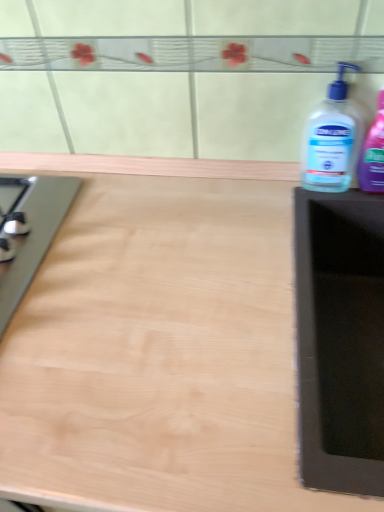
Find the location of `transparent plastic bottle at right, which is the 1th bottle from right to left`. transparent plastic bottle at right, which is the 1th bottle from right to left is located at coordinates (373, 153).

Where is `light wood countertop at center`? light wood countertop at center is located at coordinates (159, 344).

Considering the relative sizes of transparent plastic bottle at right, which appears as the 2th bottle when viewed from the right, and light wood countertop at center in the image provided, is transparent plastic bottle at right, which appears as the 2th bottle when viewed from the right, taller than light wood countertop at center?

Incorrect, the height of transparent plastic bottle at right, which appears as the 2th bottle when viewed from the right, is not larger of that of light wood countertop at center.

In the scene shown: Visually, is transparent plastic bottle at right, which appears as the 2th bottle when viewed from the right, positioned to the left or to the right of light wood countertop at center?

From the image, it's evident that transparent plastic bottle at right, which appears as the 2th bottle when viewed from the right, is to the right of light wood countertop at center.

This screenshot has width=384, height=512. I want to click on countertop in front of the transparent plastic bottle at right, the first bottle when ordered from left to right, so click(159, 344).

Considering the points (231, 418) and (358, 112), which point is behind, point (231, 418) or point (358, 112)?

The point (358, 112) is behind.

Which of these two, light wood countertop at center or transparent plastic bottle at right, the first bottle when ordered from left to right, is smaller?

Smaller between the two is transparent plastic bottle at right, the first bottle when ordered from left to right.

From the image's perspective, which is below, light wood countertop at center or transparent plastic bottle at right, the first bottle when ordered from left to right?

From the image's view, light wood countertop at center is below.

Can you confirm if light wood countertop at center is shorter than transparent plastic bottle at right, the first bottle when ordered from left to right?

Incorrect, the height of light wood countertop at center does not fall short of that of transparent plastic bottle at right, the first bottle when ordered from left to right.

Is transparent plastic bottle at right, arranged as the 2th bottle when viewed from the left, next to light wood countertop at center and touching it?

There is a gap between transparent plastic bottle at right, arranged as the 2th bottle when viewed from the left, and light wood countertop at center.

From the image's perspective, which object appears higher, transparent plastic bottle at right, which is the 1th bottle from right to left, or light wood countertop at center?

transparent plastic bottle at right, which is the 1th bottle from right to left, from the image's perspective.

This screenshot has height=512, width=384. What are the coordinates of `the 2nd bottle to the right of the light wood countertop at center, starting your count from the anchor` in the screenshot? It's located at (373, 153).

Does point (364, 180) lie in front of point (248, 229)?

That is False.

Which point is more forward, (346, 118) or (376, 138)?

The point (376, 138) is closer to the camera.

From the image's perspective, is transparent plastic bottle at right, the first bottle when ordered from left to right, located beneath transparent plastic bottle at right, arranged as the 2th bottle when viewed from the left?

Indeed, from the image's perspective, transparent plastic bottle at right, the first bottle when ordered from left to right, is shown beneath transparent plastic bottle at right, arranged as the 2th bottle when viewed from the left.

Is transparent plastic bottle at right, arranged as the 2th bottle when viewed from the left, inside transparent plastic bottle at right, the first bottle when ordered from left to right?

No, transparent plastic bottle at right, arranged as the 2th bottle when viewed from the left, is not inside transparent plastic bottle at right, the first bottle when ordered from left to right.

Considering the relative sizes of transparent plastic bottle at right, the first bottle when ordered from left to right, and transparent plastic bottle at right, arranged as the 2th bottle when viewed from the left, in the image provided, is transparent plastic bottle at right, the first bottle when ordered from left to right, bigger than transparent plastic bottle at right, arranged as the 2th bottle when viewed from the left,?

Correct, transparent plastic bottle at right, the first bottle when ordered from left to right, is larger in size than transparent plastic bottle at right, arranged as the 2th bottle when viewed from the left.

Consider the image. Is light wood countertop at center touching transparent plastic bottle at right, which is the 1th bottle from right to left?

No, light wood countertop at center is not with transparent plastic bottle at right, which is the 1th bottle from right to left.

Is point (142, 424) less distant than point (360, 176)?

Yes, it is in front of point (360, 176).

Is light wood countertop at center at the left side of transparent plastic bottle at right, arranged as the 2th bottle when viewed from the left?

Yes, light wood countertop at center is to the left of transparent plastic bottle at right, arranged as the 2th bottle when viewed from the left.

Can you confirm if transparent plastic bottle at right, which is the 1th bottle from right to left, is positioned to the right of transparent plastic bottle at right, which appears as the 2th bottle when viewed from the right?

Yes.

Is the surface of transparent plastic bottle at right, arranged as the 2th bottle when viewed from the left, in direct contact with transparent plastic bottle at right, which appears as the 2th bottle when viewed from the right?

Yes, transparent plastic bottle at right, arranged as the 2th bottle when viewed from the left, is in contact with transparent plastic bottle at right, which appears as the 2th bottle when viewed from the right.

From a real-world perspective, is transparent plastic bottle at right, arranged as the 2th bottle when viewed from the left, located beneath transparent plastic bottle at right, which appears as the 2th bottle when viewed from the right?

No, from a real-world perspective, transparent plastic bottle at right, arranged as the 2th bottle when viewed from the left, is not under transparent plastic bottle at right, which appears as the 2th bottle when viewed from the right.

Consider the image. Is transparent plastic bottle at right, arranged as the 2th bottle when viewed from the left, thinner than transparent plastic bottle at right, the first bottle when ordered from left to right?

Yes.

Find the location of a particular element. Image resolution: width=384 pixels, height=512 pixels. bottle that is the 1st one when counting upward from the light wood countertop at center (from the image's perspective) is located at coordinates (332, 140).

Where is `countertop below the transparent plastic bottle at right, which appears as the 2th bottle when viewed from the right (from the image's perspective)`? countertop below the transparent plastic bottle at right, which appears as the 2th bottle when viewed from the right (from the image's perspective) is located at coordinates tap(159, 344).

Based on their spatial positions, is transparent plastic bottle at right, arranged as the 2th bottle when viewed from the left, or transparent plastic bottle at right, the first bottle when ordered from left to right, further from light wood countertop at center?

transparent plastic bottle at right, arranged as the 2th bottle when viewed from the left.

Based on their spatial positions, is transparent plastic bottle at right, arranged as the 2th bottle when viewed from the left, or light wood countertop at center further from transparent plastic bottle at right, which appears as the 2th bottle when viewed from the right?

light wood countertop at center is further to transparent plastic bottle at right, which appears as the 2th bottle when viewed from the right.

Based on their spatial positions, is transparent plastic bottle at right, which appears as the 2th bottle when viewed from the right, or light wood countertop at center further from transparent plastic bottle at right, which is the 1th bottle from right to left?

Based on the image, light wood countertop at center appears to be further to transparent plastic bottle at right, which is the 1th bottle from right to left.

Based on their spatial positions, is light wood countertop at center or transparent plastic bottle at right, the first bottle when ordered from left to right, closer to transparent plastic bottle at right, arranged as the 2th bottle when viewed from the left?

transparent plastic bottle at right, the first bottle when ordered from left to right.

Estimate the real-world distances between objects in this image. Which object is further from transparent plastic bottle at right, which appears as the 2th bottle when viewed from the right, light wood countertop at center or transparent plastic bottle at right, arranged as the 2th bottle when viewed from the left?

light wood countertop at center lies further to transparent plastic bottle at right, which appears as the 2th bottle when viewed from the right, than the other object.

Looking at the image, which one is located further to light wood countertop at center, transparent plastic bottle at right, which appears as the 2th bottle when viewed from the right, or transparent plastic bottle at right, which is the 1th bottle from right to left?

transparent plastic bottle at right, which is the 1th bottle from right to left, is positioned further to the anchor light wood countertop at center.

Locate an element on the screen. Image resolution: width=384 pixels, height=512 pixels. bottle between transparent plastic bottle at right, which is the 1th bottle from right to left, and light wood countertop at center, in the vertical direction is located at coordinates (332, 140).